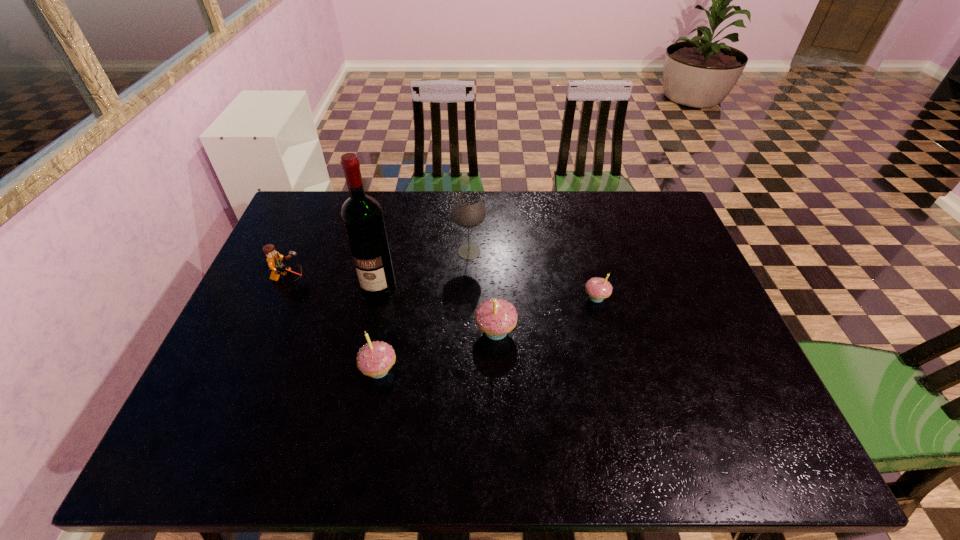
This screenshot has height=540, width=960. I want to click on vacant space that satisfies the following two spatial constraints: 1. on the front and back of the rightmost cupcake; 2. on the left side of the tallest object, so click(375, 298).

You are a GUI agent. You are given a task and a screenshot of the screen. Output one action in this format:
    pyautogui.click(x=<x>, y=<y>)
    Task: Click on the vacant space that satisfies the following two spatial constraints: 1. holding a crossbow in the hands of the Lego; 2. on the left side of the leftmost cupcake
    The height and width of the screenshot is (540, 960).
    Given the screenshot: What is the action you would take?
    pyautogui.click(x=251, y=370)

Image resolution: width=960 pixels, height=540 pixels. Identify the location of vacant position in the image that satisfies the following two spatial constraints: 1. holding a crossbow in the hands of the leftmost object; 2. on the left side of the nearest object. (251, 370).